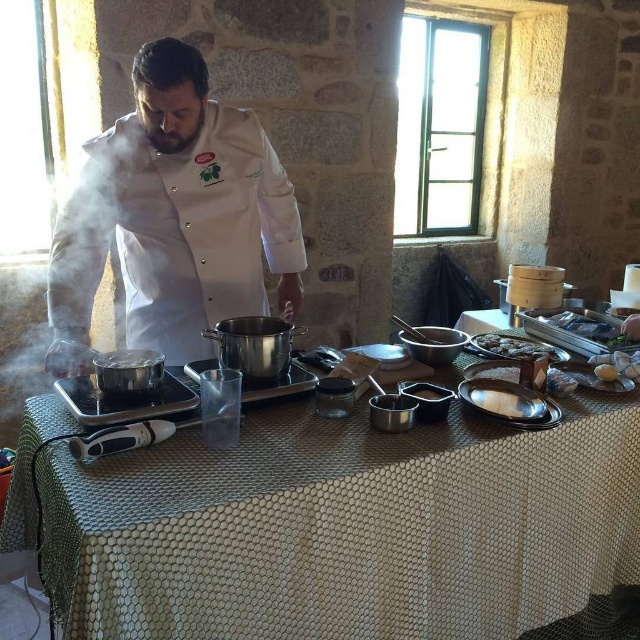
You are a sous chef in a busy kitchen. You need to place a garnish on the white glossy plate at center, but there is a shiny silver tray at right in the way. Can you access the plate without moving the tray?

The white glossy plate at center is behind the shiny silver tray at right, so you cannot access it without moving the tray.

You are a chef preparing a dish and need to place a garnish on the white glossy plate at center. The shiny silver tray at right has the garnish. Can you easily reach the garnish from the plate without moving either item?

The shiny silver tray at right is located above the white glossy plate at center, so yes, the chef can easily reach the garnish from the plate without needing to move either item.